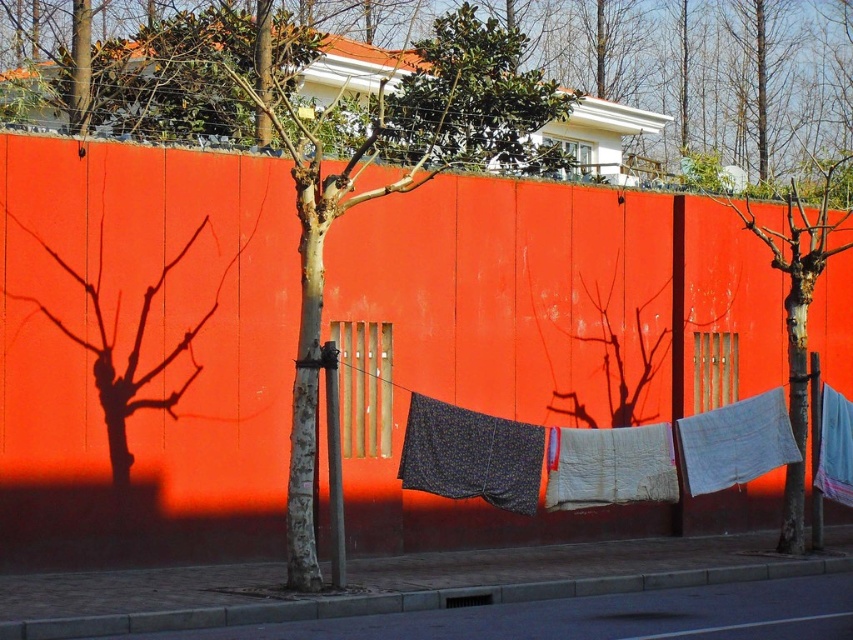
Question: Is bare wood tree at center bigger than light blue cotton cloth at center right?

Choices:
 (A) no
 (B) yes

Answer: (B)

Question: In this image, where is bare wood tree at center located relative to light blue cotton cloth at center right?

Choices:
 (A) below
 (B) above

Answer: (B)

Question: In this image, where is bare wood tree at center located relative to light blue cotton cloth at center right?

Choices:
 (A) left
 (B) right

Answer: (B)

Question: Which of the following is the farthest from the observer?

Choices:
 (A) light blue cotton cloth at center right
 (B) bare wood tree at center

Answer: (B)